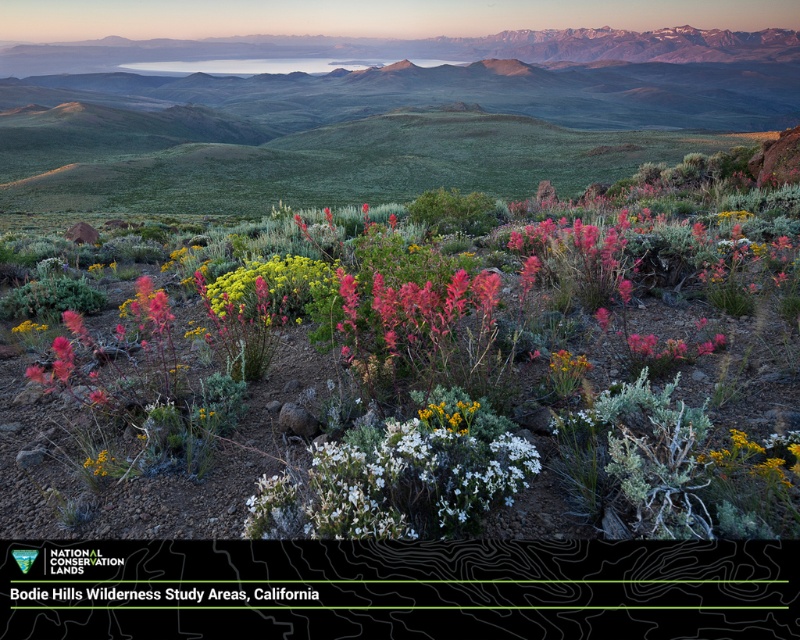
Question: Can you confirm if green grassy mountain range at upper center is wider than yellow textured flower at center-right?

Choices:
 (A) no
 (B) yes

Answer: (B)

Question: Can you confirm if green grassy mountain range at upper center is positioned above vivid crimson petals at center?

Choices:
 (A) yes
 (B) no

Answer: (A)

Question: Among these points, which one is farthest from the camera?

Choices:
 (A) (617, 124)
 (B) (212, 289)

Answer: (A)

Question: Does green grassy mountain range at upper center appear over vivid crimson petals at center?

Choices:
 (A) no
 (B) yes

Answer: (B)

Question: Estimate the real-world distances between objects in this image. Which object is farther from the green grassy mountain range at upper center?

Choices:
 (A) yellow textured flower at center-right
 (B) green leafy plant at center
 (C) vivid crimson petals at center

Answer: (A)

Question: Which of the following is the closest to the observer?

Choices:
 (A) (458, 310)
 (B) (552, 108)
 (C) (752, 452)
 (D) (236, 292)

Answer: (C)